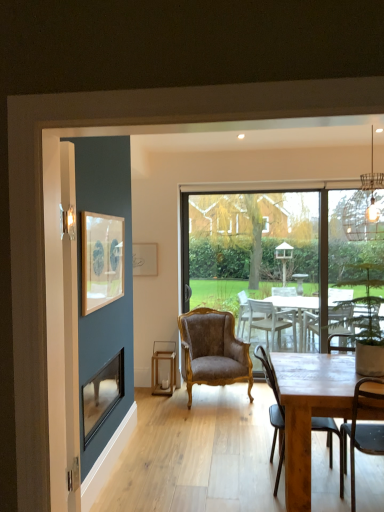
Question: Is the depth of brown velvet armchair at center, which appears as the 1th chair when viewed from the back, less than that of transparent glass window at center?

Choices:
 (A) yes
 (B) no

Answer: (A)

Question: Is brown velvet armchair at center, which appears as the 1th chair when viewed from the back, not near transparent glass window at center?

Choices:
 (A) no
 (B) yes

Answer: (B)

Question: From a real-world perspective, does brown velvet armchair at center, which appears as the 1th chair when viewed from the back, sit lower than transparent glass window at center?

Choices:
 (A) no
 (B) yes

Answer: (B)

Question: From the image's perspective, is brown velvet armchair at center, which appears as the 1th chair when viewed from the back, on transparent glass window at center?

Choices:
 (A) yes
 (B) no

Answer: (B)

Question: Would you say brown velvet armchair at center, the 3th chair from the front, contains transparent glass window at center?

Choices:
 (A) yes
 (B) no

Answer: (B)

Question: Considering their positions, is matte white picture frame at upper center, acting as the 2th picture frame starting from the front, located in front of or behind wooden chair at right, marked as the second chair in a front-to-back arrangement?

Choices:
 (A) behind
 (B) front

Answer: (A)

Question: Is matte white picture frame at upper center, which appears as the first picture frame when viewed from the back, inside or outside of wooden chair at right, arranged as the 2th chair when viewed from the back?

Choices:
 (A) inside
 (B) outside

Answer: (B)

Question: Visually, is matte white picture frame at upper center, which appears as the first picture frame when viewed from the back, positioned to the left or to the right of wooden chair at right, arranged as the 2th chair when viewed from the back?

Choices:
 (A) right
 (B) left

Answer: (B)

Question: From the image's perspective, is matte white picture frame at upper center, acting as the 2th picture frame starting from the front, positioned above or below wooden chair at right, arranged as the 2th chair when viewed from the back?

Choices:
 (A) above
 (B) below

Answer: (A)

Question: From a real-world perspective, is metallic wire cage at upper right positioned above or below matte white picture frame at upper center, which appears as the first picture frame when viewed from the back?

Choices:
 (A) above
 (B) below

Answer: (A)

Question: From the image's perspective, is metallic wire cage at upper right positioned above or below matte white picture frame at upper center, which appears as the first picture frame when viewed from the back?

Choices:
 (A) below
 (B) above

Answer: (B)

Question: Is point (382, 239) closer or farther from the camera than point (132, 245)?

Choices:
 (A) farther
 (B) closer

Answer: (B)

Question: In terms of size, does metallic wire cage at upper right appear bigger or smaller than matte white picture frame at upper center, acting as the 2th picture frame starting from the front?

Choices:
 (A) big
 (B) small

Answer: (A)

Question: From a real-world perspective, is brown velvet armchair at center, which appears as the 1th chair when viewed from the back, above or below matte white picture frame at upper center, which appears as the first picture frame when viewed from the back?

Choices:
 (A) above
 (B) below

Answer: (B)

Question: Is brown velvet armchair at center, the 3th chair from the front, bigger or smaller than matte white picture frame at upper center, acting as the 2th picture frame starting from the front?

Choices:
 (A) small
 (B) big

Answer: (B)